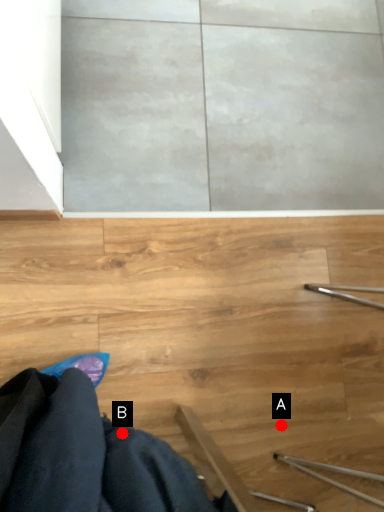
Question: Two points are circled on the image, labeled by A and B beside each circle. Which point appears farthest from the camera in this image?

Choices:
 (A) A is further
 (B) B is further

Answer: (A)